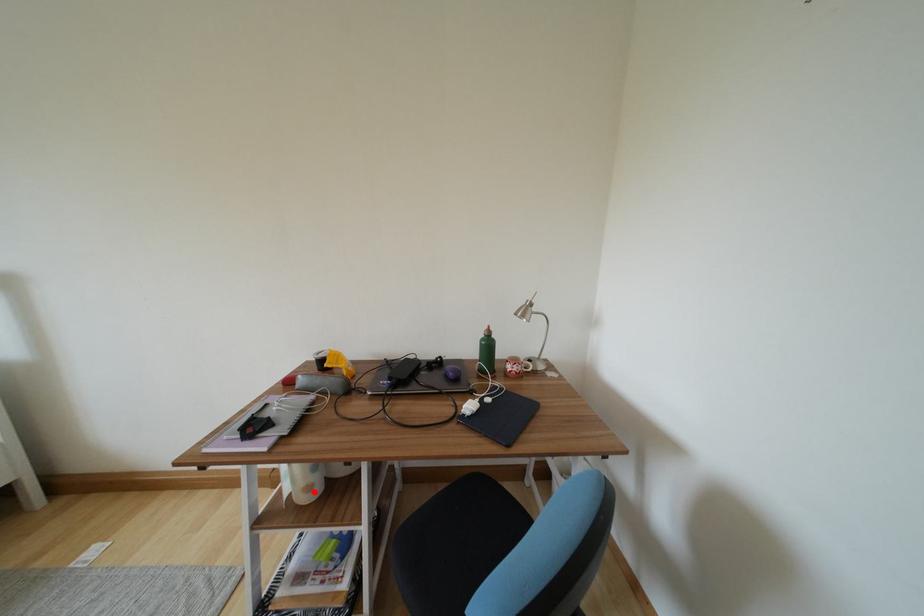
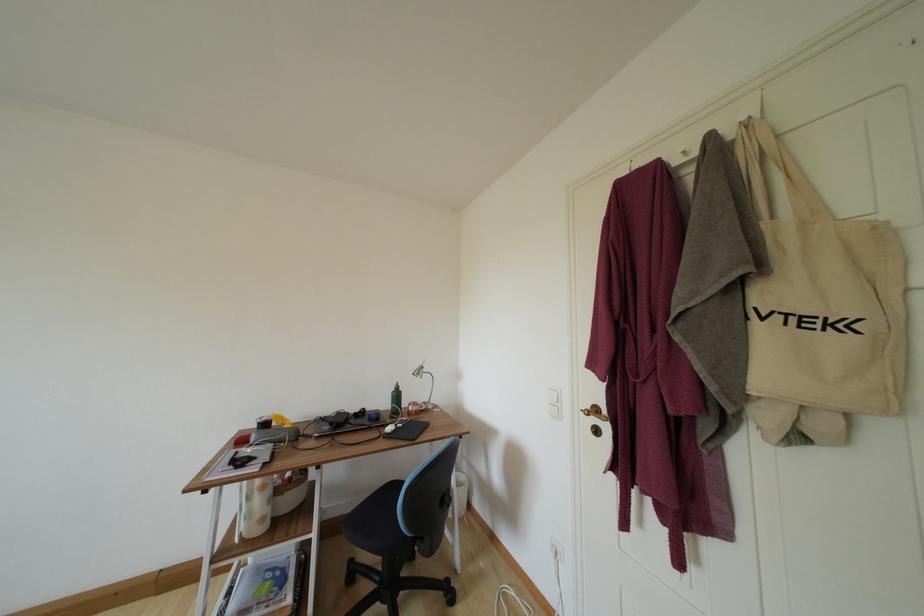
Question: I am providing you with two images of the same scene from different viewpoints. Given a red point in image1, look at the same physical point in image2. Is it:

Choices:
 (A) Closer to the viewpoint
 (B) Farther from the viewpoint

Answer: (A)